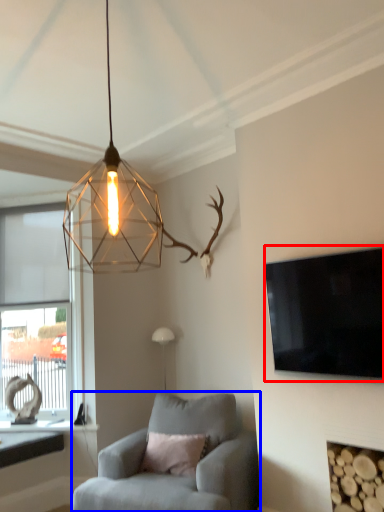
Question: Which point is further to the camera, television (highlighted by a red box) or chair (highlighted by a blue box)?

Choices:
 (A) television
 (B) chair

Answer: (B)